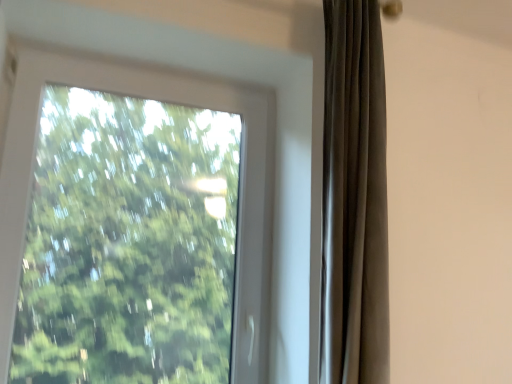
Image resolution: width=512 pixels, height=384 pixels. What do you see at coordinates (151, 98) in the screenshot?
I see `white plastic window at upper left` at bounding box center [151, 98].

Where is `white plastic window at upper left`? Image resolution: width=512 pixels, height=384 pixels. white plastic window at upper left is located at coordinates (151, 98).

Where is `white plastic window at upper left`? white plastic window at upper left is located at coordinates (151, 98).